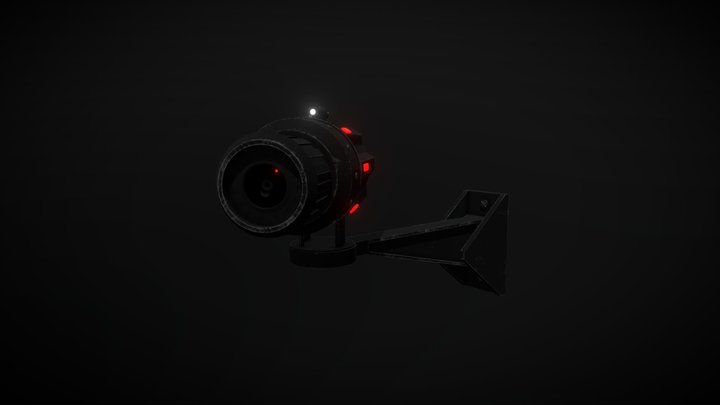
You are a GUI agent. You are given a task and a screenshot of the screen. Output one action in this format:
    pyautogui.click(x=<x>, y=<y>)
    Task: Click on the stand that holds camera device upright
    This screenshot has height=405, width=720.
    Given the screenshot: What is the action you would take?
    pyautogui.click(x=341, y=252)